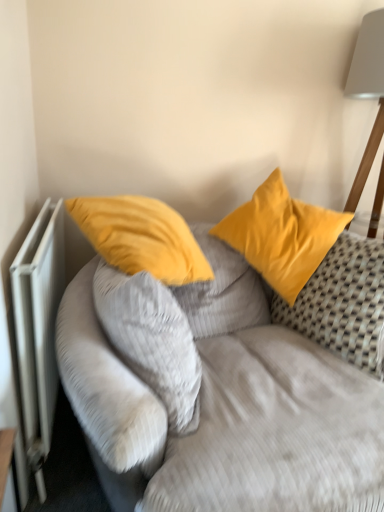
Question: Would you consider velvet yellow pillows at upper center to be distant from matte yellow pillow at center, which is the 1th pillow from left to right?

Choices:
 (A) yes
 (B) no

Answer: (B)

Question: Is matte yellow pillow at center, which is the 1th pillow from left to right, at the back of velvet yellow pillows at upper center?

Choices:
 (A) no
 (B) yes

Answer: (B)

Question: Considering the relative sizes of velvet yellow pillows at upper center and matte yellow pillow at center, which is the 1th pillow from left to right, in the image provided, is velvet yellow pillows at upper center thinner than matte yellow pillow at center, which is the 1th pillow from left to right,?

Choices:
 (A) no
 (B) yes

Answer: (A)

Question: Considering the relative positions of velvet yellow pillows at upper center and matte yellow pillow at center, which is the 1th pillow from left to right, in the image provided, is velvet yellow pillows at upper center to the left of matte yellow pillow at center, which is the 1th pillow from left to right, from the viewer's perspective?

Choices:
 (A) yes
 (B) no

Answer: (B)

Question: Does velvet yellow pillows at upper center have a smaller size compared to matte yellow pillow at center, which is the 1th pillow from left to right?

Choices:
 (A) no
 (B) yes

Answer: (A)

Question: In terms of height, does white metallic radiator at left look taller or shorter compared to matte yellow pillow at center, which is the 1th pillow from left to right?

Choices:
 (A) short
 (B) tall

Answer: (B)

Question: From a real-world perspective, is white metallic radiator at left positioned above or below matte yellow pillow at center, the second pillow when ordered from right to left?

Choices:
 (A) above
 (B) below

Answer: (B)

Question: Does point (44, 386) appear closer or farther from the camera than point (145, 287)?

Choices:
 (A) closer
 (B) farther

Answer: (B)

Question: Looking at the image, does white metallic radiator at left seem bigger or smaller compared to matte yellow pillow at center, which is the 1th pillow from left to right?

Choices:
 (A) big
 (B) small

Answer: (B)

Question: Considering their positions, is white metallic radiator at left located in front of or behind satin yellow pillow at upper right, which is the second pillow in left-to-right order?

Choices:
 (A) behind
 (B) front

Answer: (B)

Question: From a real-world perspective, is white metallic radiator at left above or below satin yellow pillow at upper right, which is the 1th pillow from right to left?

Choices:
 (A) above
 (B) below

Answer: (B)

Question: Based on their sizes in the image, would you say white metallic radiator at left is bigger or smaller than satin yellow pillow at upper right, which is the second pillow in left-to-right order?

Choices:
 (A) big
 (B) small

Answer: (B)

Question: From their relative heights in the image, would you say white metallic radiator at left is taller or shorter than satin yellow pillow at upper right, which is the second pillow in left-to-right order?

Choices:
 (A) short
 (B) tall

Answer: (B)

Question: In terms of height, does matte yellow pillow at center, the second pillow when ordered from right to left, look taller or shorter compared to velvet yellow pillows at upper center?

Choices:
 (A) tall
 (B) short

Answer: (B)

Question: Is matte yellow pillow at center, which is the 1th pillow from left to right, in front of or behind velvet yellow pillows at upper center in the image?

Choices:
 (A) front
 (B) behind

Answer: (B)